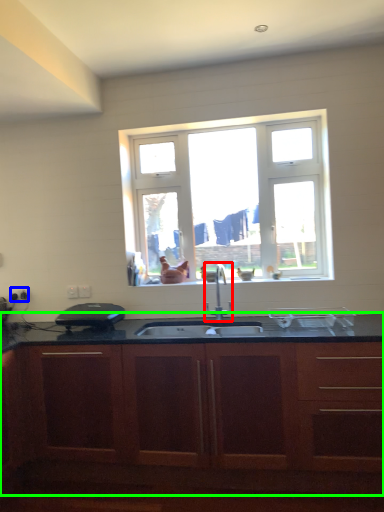
Question: Considering the real-world distances, which object is farthest from tap (highlighted by a red box)? electric outlet (highlighted by a blue box) or cabinetry (highlighted by a green box)?

Choices:
 (A) electric outlet
 (B) cabinetry

Answer: (A)